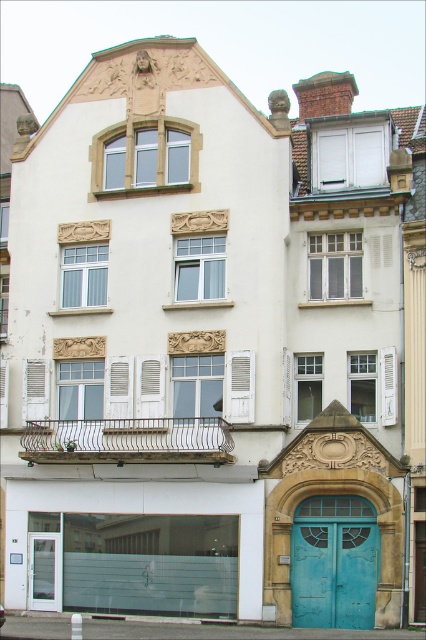
Between teal painted wood door at center and clear glass door at lower left, which one has less height?

With less height is clear glass door at lower left.

Is point (328, 548) farther from camera compared to point (55, 554)?

No, (328, 548) is in front of (55, 554).

Locate an element on the screen. This screenshot has width=426, height=640. teal painted wood door at center is located at coordinates (333, 573).

At what (x,y) coordinates should I click in order to perform the action: click on teal painted wood door at center. Please return your answer as a coordinate pair (x, y). The width and height of the screenshot is (426, 640). Looking at the image, I should click on (333, 573).